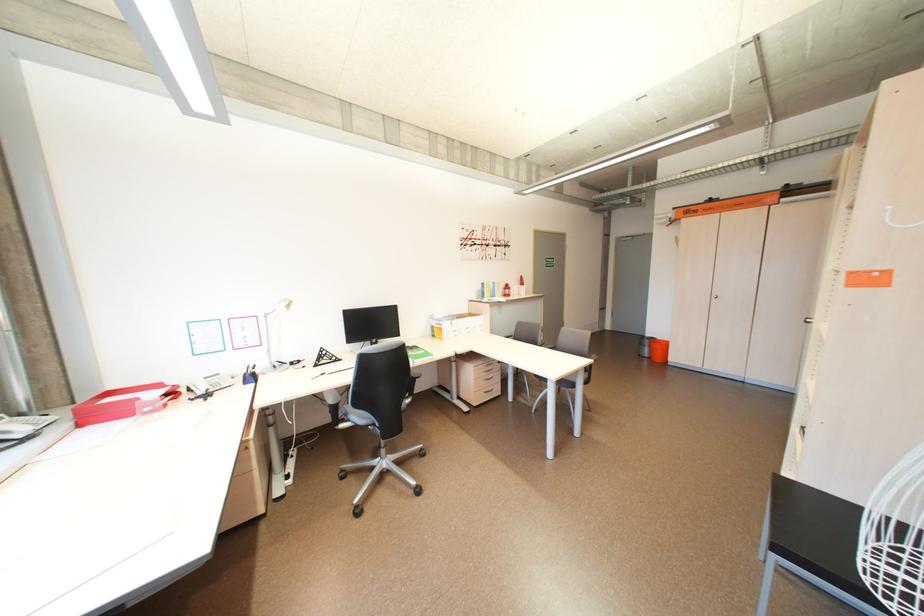
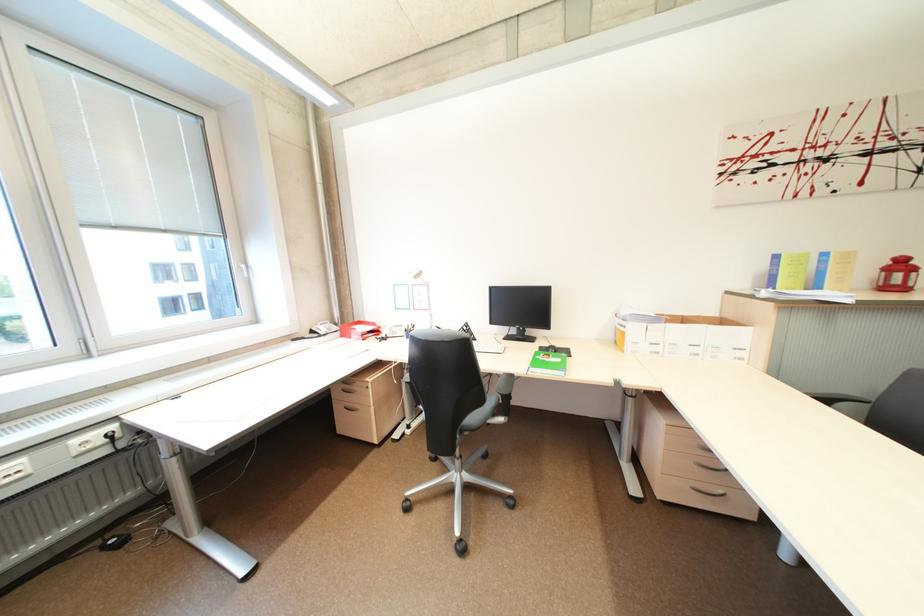
Locate, in the second image, the point that corresponds to (x=31, y=416) in the first image.

(345, 325)